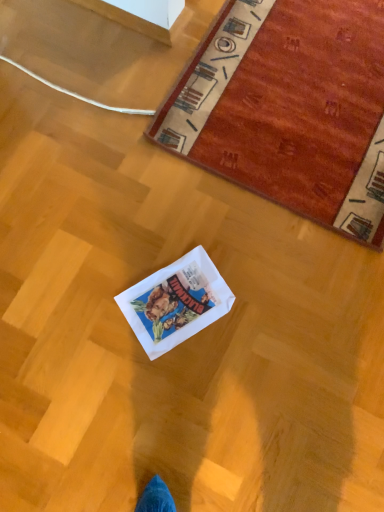
Find the location of a particular element. white paper bag at center is located at coordinates (176, 302).

The image size is (384, 512). What do you see at coordinates (176, 302) in the screenshot? I see `white paper bag at center` at bounding box center [176, 302].

Locate an element on the screen. The width and height of the screenshot is (384, 512). white paper bag at center is located at coordinates (176, 302).